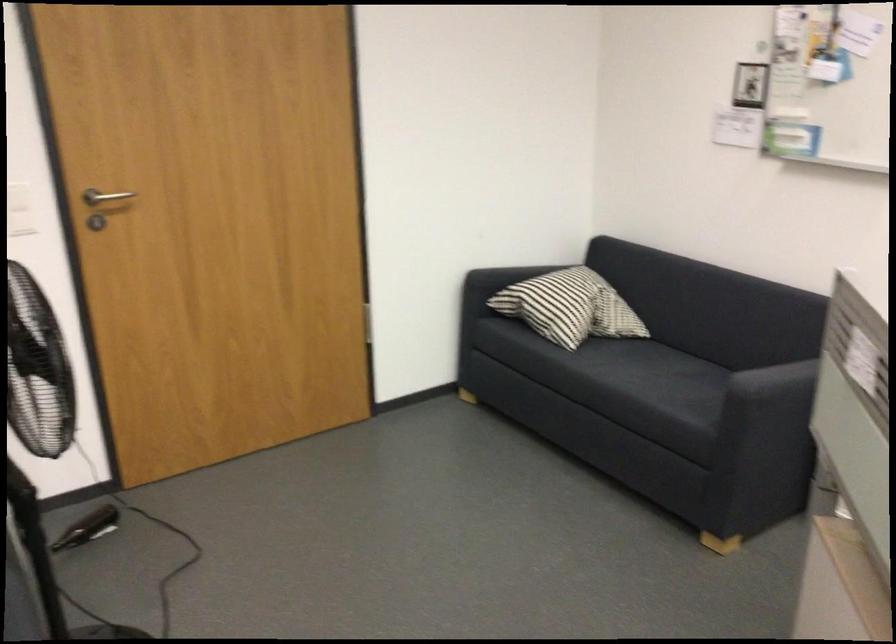
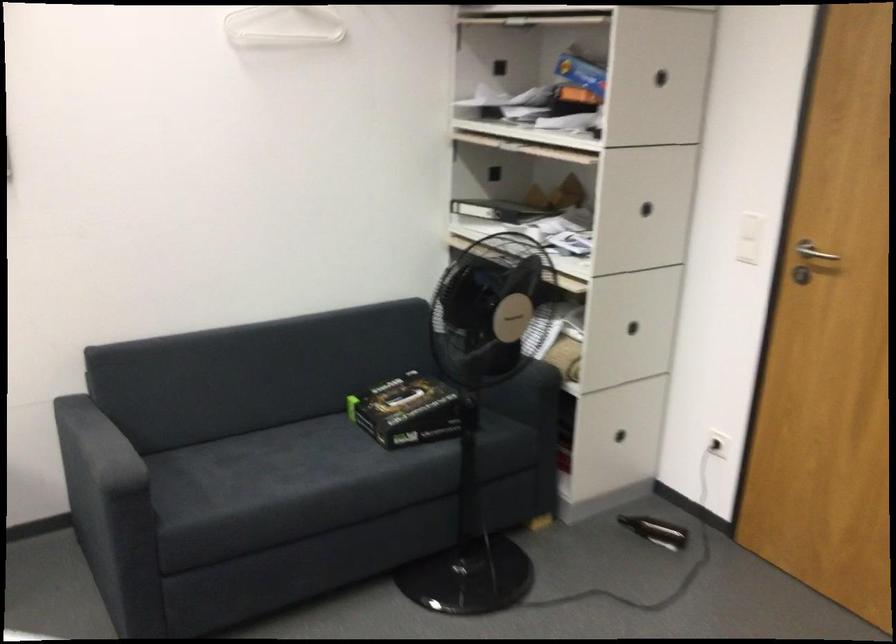
The point at (85, 214) is marked in the first image. Where is the corresponding point in the second image?

(813, 252)